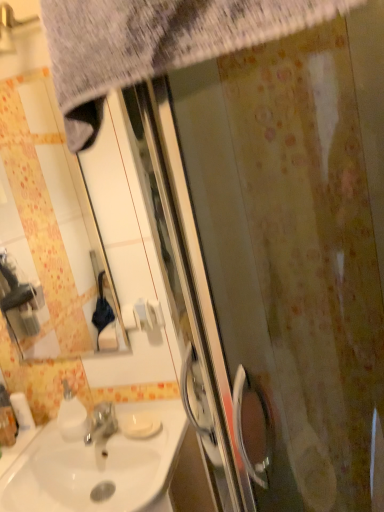
Question: Is there a large distance between textured gray towel at upper left and white glossy sink at lower left?

Choices:
 (A) yes
 (B) no

Answer: (B)

Question: From the image's perspective, is textured gray towel at upper left over white glossy sink at lower left?

Choices:
 (A) yes
 (B) no

Answer: (A)

Question: Is textured gray towel at upper left positioned in front of white glossy sink at lower left?

Choices:
 (A) no
 (B) yes

Answer: (B)

Question: From the image's perspective, is textured gray towel at upper left under white glossy sink at lower left?

Choices:
 (A) yes
 (B) no

Answer: (B)

Question: Is textured gray towel at upper left further to the viewer compared to white glossy sink at lower left?

Choices:
 (A) no
 (B) yes

Answer: (A)

Question: Is textured gray towel at upper left thinner than white glossy sink at lower left?

Choices:
 (A) yes
 (B) no

Answer: (A)

Question: From a real-world perspective, is white matte toilet paper at lower left positioned over matte white mirror at upper left based on gravity?

Choices:
 (A) no
 (B) yes

Answer: (A)

Question: From the image's perspective, does white matte toilet paper at lower left appear higher than matte white mirror at upper left?

Choices:
 (A) no
 (B) yes

Answer: (A)

Question: Is white matte toilet paper at lower left facing away from matte white mirror at upper left?

Choices:
 (A) yes
 (B) no

Answer: (B)

Question: From a real-world perspective, is white matte toilet paper at lower left physically below matte white mirror at upper left?

Choices:
 (A) yes
 (B) no

Answer: (A)

Question: Does white matte toilet paper at lower left have a greater height compared to matte white mirror at upper left?

Choices:
 (A) no
 (B) yes

Answer: (A)

Question: Is white matte toilet paper at lower left aimed at matte white mirror at upper left?

Choices:
 (A) no
 (B) yes

Answer: (A)

Question: Can you confirm if matte white mirror at upper left is bigger than white glossy sink at lower left?

Choices:
 (A) yes
 (B) no

Answer: (B)